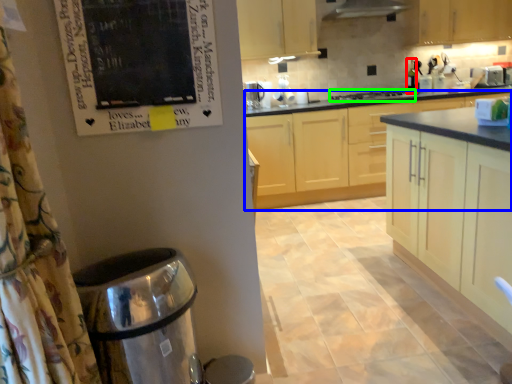
Question: Based on their relative distances, which object is farther from bottle (highlighted by a red box)? Choose from cabinetry (highlighted by a blue box) and home appliance (highlighted by a green box).

Choices:
 (A) cabinetry
 (B) home appliance

Answer: (A)